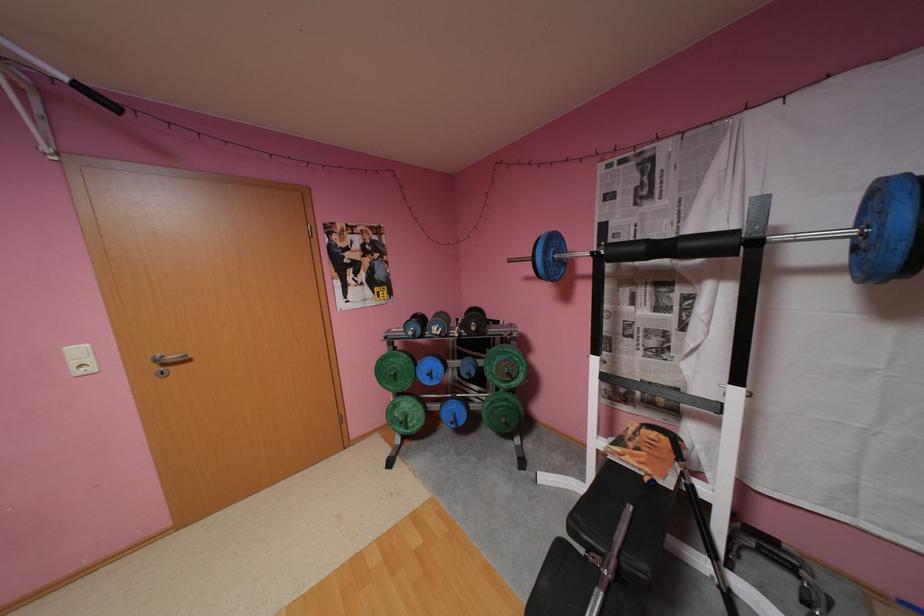
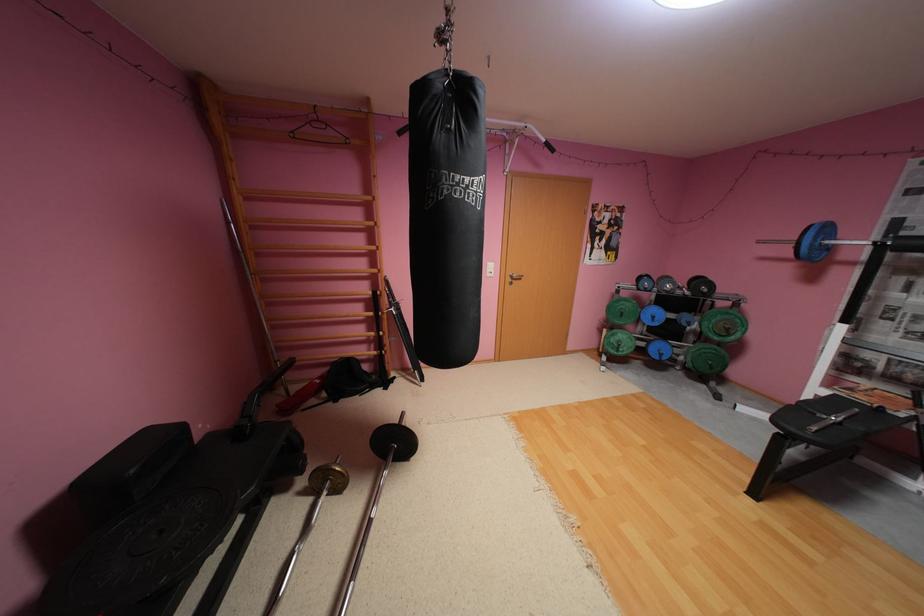
Where in the second image is the point corresponding to the point at 482,328 from the first image?

(714, 291)